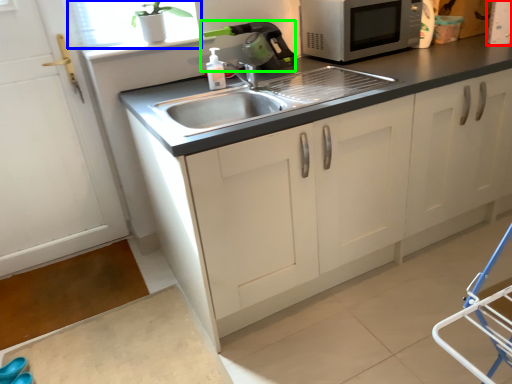
Question: Considering the real-world distances, which object is farthest from appliance (highlighted by a red box)? window screen (highlighted by a blue box) or appliance (highlighted by a green box)?

Choices:
 (A) window screen
 (B) appliance

Answer: (A)